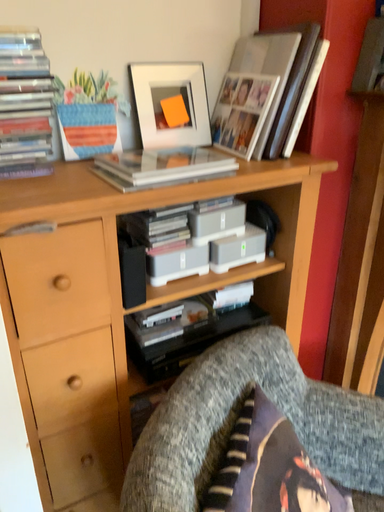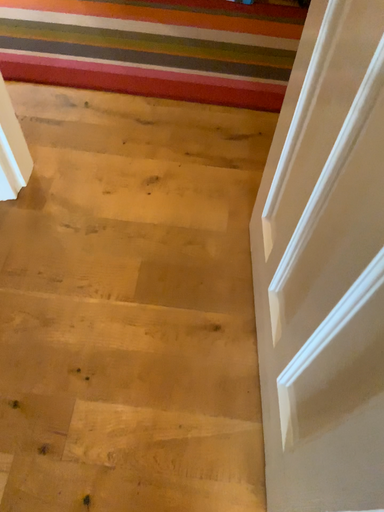
Question: How did the camera likely rotate when shooting the video?

Choices:
 (A) rotated left
 (B) rotated right

Answer: (A)